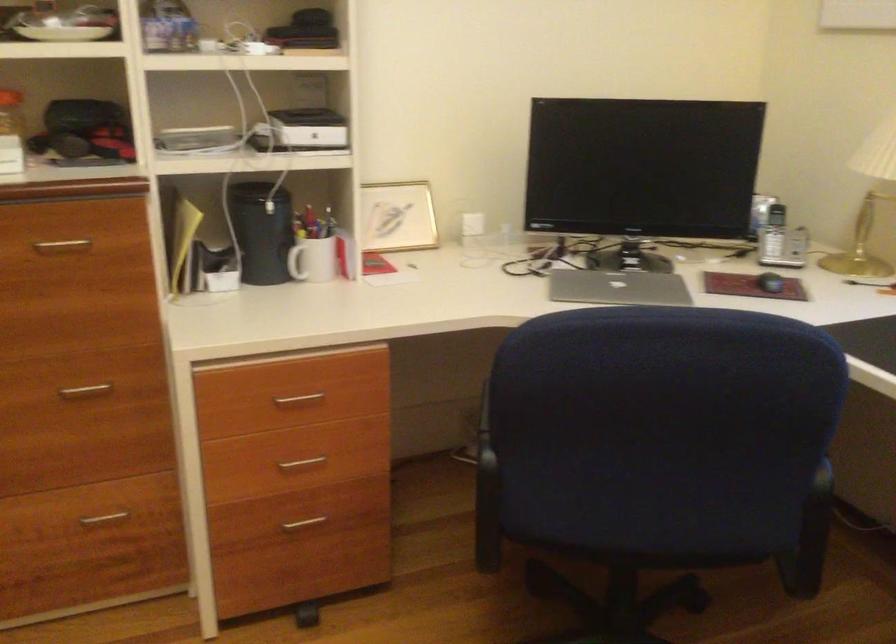
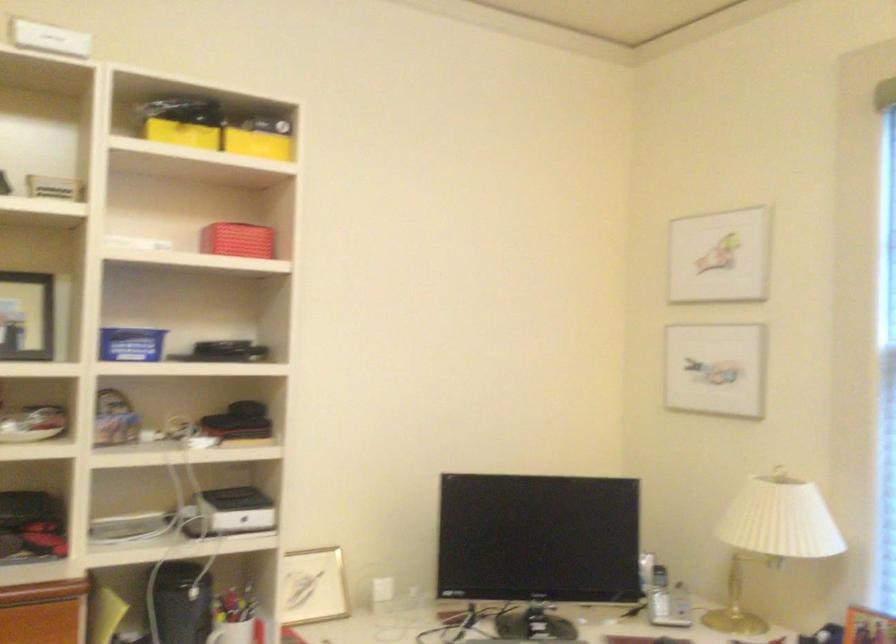
Where in the second image is the point corresponding to pixel 297 124 from the first image?

(231, 512)